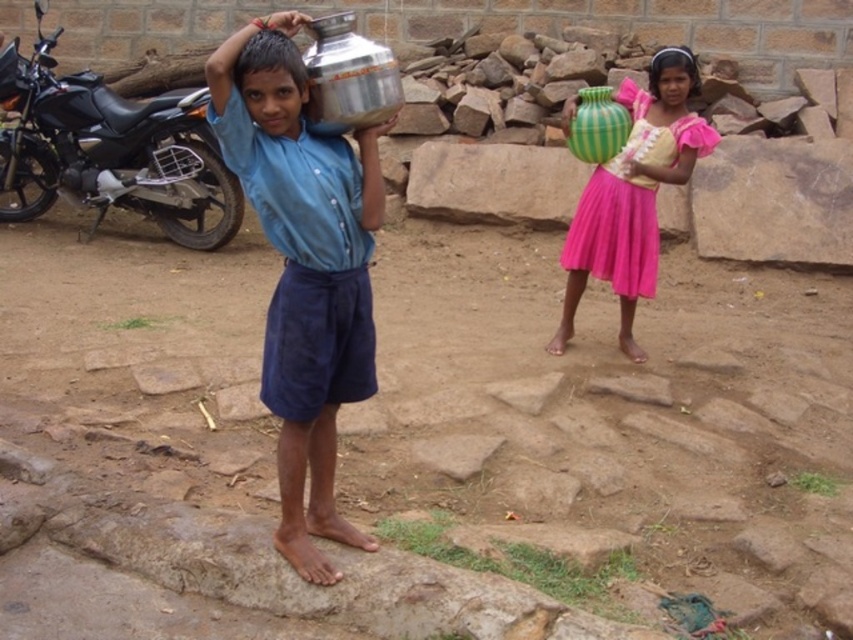
Question: Among these objects, which one is nearest to the camera?

Choices:
 (A) green striped vase at center
 (B) metallic silver water container at upper center

Answer: (B)

Question: Does black metallic motorcycle at left have a lesser width compared to green striped vase at center?

Choices:
 (A) yes
 (B) no

Answer: (B)

Question: Among these objects, which one is nearest to the camera?

Choices:
 (A) shiny metallic pot at center
 (B) black metallic motorcycle at left

Answer: (A)

Question: In this image, where is black metallic motorcycle at left located relative to green striped vase at center?

Choices:
 (A) above
 (B) below

Answer: (A)

Question: Estimate the real-world distances between objects in this image. Which object is farther from the shiny metallic pot at center?

Choices:
 (A) metallic silver water container at upper center
 (B) black metallic motorcycle at left

Answer: (B)

Question: Is black metallic motorcycle at left thinner than metallic silver water container at upper center?

Choices:
 (A) yes
 (B) no

Answer: (B)